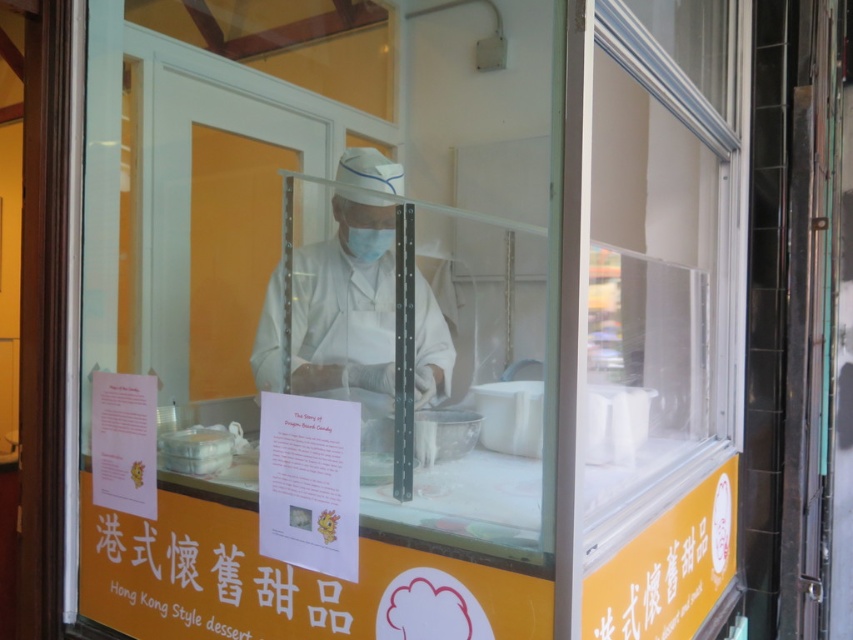
Locate an element on the screen. This screenshot has width=853, height=640. white matte uniform at center is located at coordinates (345, 312).

Can you confirm if orange paper sign at lower center is wider than white matte uniform at center?

Yes, orange paper sign at lower center is wider than white matte uniform at center.

Does orange paper sign at lower center appear under white matte uniform at center?

Yes, orange paper sign at lower center is below white matte uniform at center.

What do you see at coordinates (204, 579) in the screenshot? The width and height of the screenshot is (853, 640). I see `orange paper sign at lower center` at bounding box center [204, 579].

The height and width of the screenshot is (640, 853). Identify the location of orange paper sign at lower center. click(x=204, y=579).

Between point (194, 524) and point (368, 250), which one is positioned in front?

Positioned in front is point (194, 524).

Image resolution: width=853 pixels, height=640 pixels. In order to click on orange paper sign at lower center in this screenshot , I will do `click(204, 579)`.